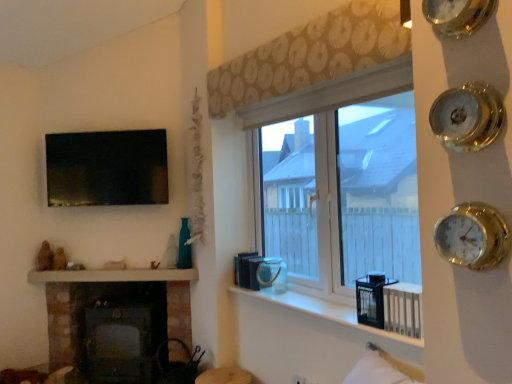
Image resolution: width=512 pixels, height=384 pixels. What are the coordinates of `beige patterned curtain at upper center` in the screenshot? It's located at (310, 55).

This screenshot has width=512, height=384. Identify the location of matte black tv at upper left. (106, 168).

The height and width of the screenshot is (384, 512). Describe the element at coordinates (106, 168) in the screenshot. I see `matte black tv at upper left` at that location.

The height and width of the screenshot is (384, 512). I want to click on white glossy window sill at center, so click(324, 311).

Describe the element at coordinates (322, 148) in the screenshot. I see `clear glass window at center` at that location.

The image size is (512, 384). What do you see at coordinates (113, 275) in the screenshot? I see `white glossy mantle at lower left` at bounding box center [113, 275].

Identify the location of black plastic radiator at lower right. (403, 309).

In terms of size, does black plastic radiator at lower right appear bigger or smaller than white glossy mantle at lower left?

Clearly, black plastic radiator at lower right is smaller in size than white glossy mantle at lower left.

From the image's perspective, between black plastic radiator at lower right and white glossy mantle at lower left, who is located below?

white glossy mantle at lower left, from the image's perspective.

Is black plastic radiator at lower right closer to the viewer compared to white glossy mantle at lower left?

Yes.

Is black plastic radiator at lower right positioned far away from white glossy mantle at lower left?

Absolutely, black plastic radiator at lower right is distant from white glossy mantle at lower left.

Considering the positions of point (250, 373) and point (387, 38), is point (250, 373) closer or farther from the camera than point (387, 38)?

Point (250, 373) is farther from the camera than point (387, 38).

Find the location of a particular element. furniture lying below the beige patterned curtain at upper center (from the image's perspective) is located at coordinates (224, 376).

Based on the photo, is matte brown vase at lower center oriented towards beige patterned curtain at upper center?

No.

From the image's perspective, relative to white glossy mantle at lower left, is clear glass window at center above or below?

clear glass window at center is situated higher than white glossy mantle at lower left in the image.

Are clear glass window at center and white glossy mantle at lower left located far from each other?

Absolutely, clear glass window at center is distant from white glossy mantle at lower left.

This screenshot has height=384, width=512. Identify the location of window on the right side of white glossy mantle at lower left. (322, 148).

How many degrees apart are the facing directions of white glossy window sill at center and white glossy mantle at lower left?

white glossy window sill at center and white glossy mantle at lower left are facing 45.8 degrees away from each other.

Considering the points (298, 308) and (168, 271), which point is in front, point (298, 308) or point (168, 271)?

Point (298, 308)

In the image, is white glossy window sill at center positioned in front of or behind white glossy mantle at lower left?

white glossy window sill at center is in front of white glossy mantle at lower left.

How distant is white glossy window sill at center from white glossy mantle at lower left?

white glossy window sill at center is 38.65 inches away from white glossy mantle at lower left.

Based on the photo, is gold metallic clock at upper right, the 1th clock ordered from the bottom, outside of dark gray metal wood burning stove at lower left?

That's correct, gold metallic clock at upper right, the 1th clock ordered from the bottom, is outside of dark gray metal wood burning stove at lower left.

Who is shorter, gold metallic clock at upper right, the second clock when ordered from top to bottom, or dark gray metal wood burning stove at lower left?

Standing shorter between the two is gold metallic clock at upper right, the second clock when ordered from top to bottom.

From the dark gray metal wood burning stove at lower left, count 2nd clock to the right and point to it. Please provide its 2D coordinates.

[(472, 236)]

From a real-world perspective, does gold metallic clock at upper right, the 1th clock ordered from the bottom, sit lower than dark gray metal wood burning stove at lower left?

Incorrect, from a real-world perspective, gold metallic clock at upper right, the 1th clock ordered from the bottom, is higher than dark gray metal wood burning stove at lower left.

The width and height of the screenshot is (512, 384). In the image, there is a black plastic radiator at lower right. In order to click on furniture below it (from a real-world perspective) in this screenshot , I will do `click(224, 376)`.

From the image's perspective, is black plastic radiator at lower right under matte brown vase at lower center?

No.

Is matte brown vase at lower center completely or partially inside black plastic radiator at lower right?

No, matte brown vase at lower center is not a part of black plastic radiator at lower right.

Who is bigger, black plastic radiator at lower right or matte brown vase at lower center?

Bigger between the two is matte brown vase at lower center.

Does clear glass window at center have a greater width compared to matte brown vase at lower center?

No, clear glass window at center is not wider than matte brown vase at lower center.

From the image's perspective, which one is positioned higher, clear glass window at center or matte brown vase at lower center?

clear glass window at center.

From a real-world perspective, is clear glass window at center on top of matte brown vase at lower center?

Correct, in the physical world, clear glass window at center is higher than matte brown vase at lower center.

Can you confirm if clear glass window at center is positioned to the left of matte brown vase at lower center?

No, clear glass window at center is not to the left of matte brown vase at lower center.

This screenshot has width=512, height=384. What are the coordinates of `radiator above the white glossy mantle at lower left (from the image's perspective)` in the screenshot? It's located at (403, 309).

The width and height of the screenshot is (512, 384). I want to click on furniture that appears on the left of beige patterned curtain at upper center, so click(x=224, y=376).

Considering their positions, is beige patterned curtain at upper center positioned closer to dark gray metal wood burning stove at lower left than white glossy window sill at center?

Based on the image, white glossy window sill at center appears to be nearer to dark gray metal wood burning stove at lower left.

When comparing their distances from matte black tv at upper left, does black plastic radiator at lower right or clear glass window at center seem closer?

clear glass window at center.

From the image, which object appears to be farther from matte brown vase at lower center, gold metallic clock at upper right, positioned as the 2th clock in bottom-to-top order, or black plastic radiator at lower right?

The object further to matte brown vase at lower center is gold metallic clock at upper right, positioned as the 2th clock in bottom-to-top order.

When comparing their distances from white glossy mantle at lower left, does dark gray metal wood burning stove at lower left or gold metallic clock at upper right, which is the 1th clock from top to bottom, seem closer?

dark gray metal wood burning stove at lower left.

From the image, which object appears to be farther from white glossy mantle at lower left, beige patterned curtain at upper center or clear glass window at center?

beige patterned curtain at upper center is further to white glossy mantle at lower left.

From the image, which object appears to be nearer to clear glass window at center, gold metallic clock at upper right, positioned as the 2th clock in bottom-to-top order, or beige patterned curtain at upper center?

beige patterned curtain at upper center is closer to clear glass window at center.

From the image, which object appears to be nearer to white glossy window sill at center, dark gray metal wood burning stove at lower left or white glossy mantle at lower left?

Among the two, white glossy mantle at lower left is located nearer to white glossy window sill at center.

Based on their spatial positions, is matte black tv at upper left or clear glass window at center further from black plastic radiator at lower right?

The object further to black plastic radiator at lower right is matte black tv at upper left.

Find the location of a particular element. The width and height of the screenshot is (512, 384). window sill located between matte brown vase at lower center and black plastic radiator at lower right in the left-right direction is located at coordinates (324, 311).

Find the location of a particular element. window sill between gold metallic clock at upper right, positioned as the 2th clock in bottom-to-top order, and matte black tv at upper left, along the z-axis is located at coordinates (324, 311).

Identify the location of radiator between gold metallic clock at upper right, positioned as the 2th clock in bottom-to-top order, and matte black tv at upper left in the front-back direction. The image size is (512, 384). (403, 309).

Identify the location of window sill between beige patterned curtain at upper center and matte black tv at upper left from front to back. (324, 311).